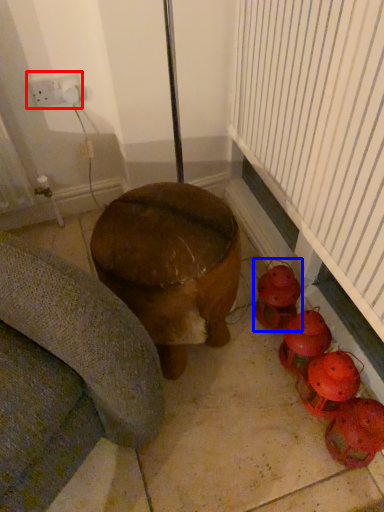
Question: Which point is further to the camera, electric outlet (highlighted by a red box) or toy (highlighted by a blue box)?

Choices:
 (A) electric outlet
 (B) toy

Answer: (A)